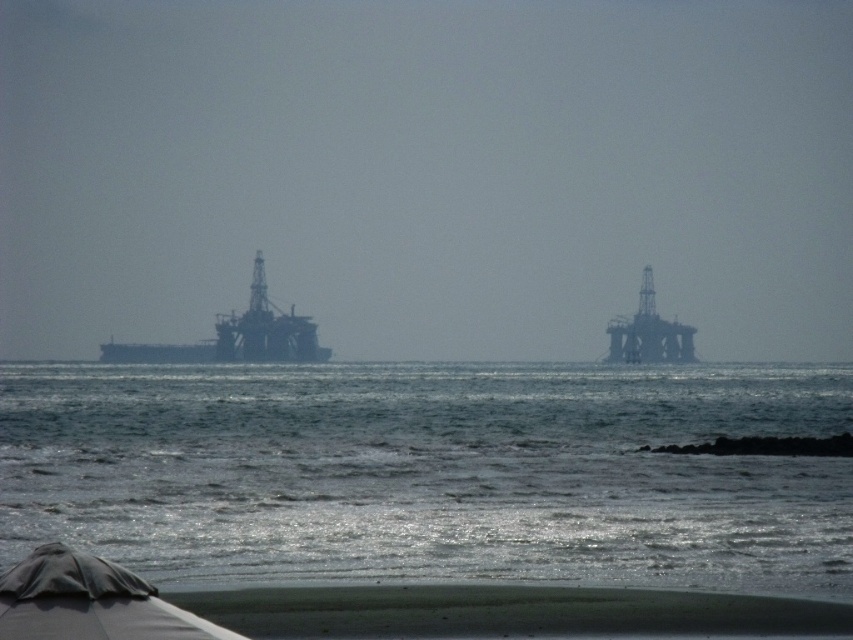
Question: Which point is farther from the camera taking this photo?

Choices:
 (A) (454, 492)
 (B) (38, 604)
 (C) (230, 321)

Answer: (C)

Question: Does clear water at lower center have a lesser width compared to gray fabric umbrella at lower left?

Choices:
 (A) no
 (B) yes

Answer: (A)

Question: Which point is closer to the camera?

Choices:
 (A) (68, 364)
 (B) (51, 547)
 (C) (260, 328)

Answer: (B)

Question: Is gray fabric umbrella at lower left below dark gray metallic oil rig at left?

Choices:
 (A) no
 (B) yes

Answer: (B)

Question: Estimate the real-world distances between objects in this image. Which object is farther from the gray fabric umbrella at lower left?

Choices:
 (A) dark gray metallic oil rig at left
 (B) clear water at lower center

Answer: (A)

Question: In this image, where is clear water at lower center located relative to dark gray metallic oil rig at left?

Choices:
 (A) above
 (B) below

Answer: (B)